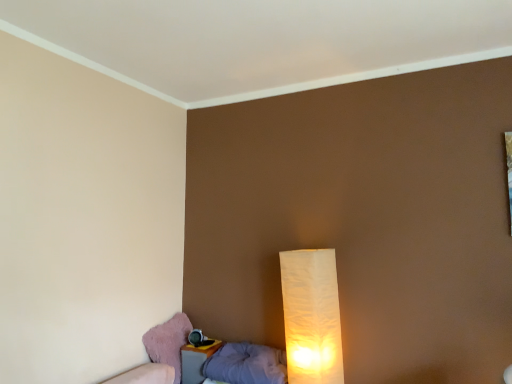
Question: Does gray fabric pillow at lower left appear on the right side of pink fabric swivel chair at lower left?

Choices:
 (A) yes
 (B) no

Answer: (A)

Question: Does gray fabric pillow at lower left lie in front of pink fabric swivel chair at lower left?

Choices:
 (A) yes
 (B) no

Answer: (A)

Question: Can you confirm if gray fabric pillow at lower left is wider than pink fabric swivel chair at lower left?

Choices:
 (A) yes
 (B) no

Answer: (A)

Question: Does gray fabric pillow at lower left have a larger size compared to pink fabric swivel chair at lower left?

Choices:
 (A) yes
 (B) no

Answer: (A)

Question: Does gray fabric pillow at lower left appear on the left side of pink fabric swivel chair at lower left?

Choices:
 (A) no
 (B) yes

Answer: (A)

Question: Does gray fabric pillow at lower left come behind pink fabric swivel chair at lower left?

Choices:
 (A) yes
 (B) no

Answer: (B)

Question: From a real-world perspective, is white paper lamp at lower right under gray fabric pillow at lower left?

Choices:
 (A) no
 (B) yes

Answer: (A)

Question: Is white paper lamp at lower right not within gray fabric pillow at lower left?

Choices:
 (A) yes
 (B) no

Answer: (A)

Question: Is white paper lamp at lower right facing away from gray fabric pillow at lower left?

Choices:
 (A) no
 (B) yes

Answer: (A)

Question: Can you confirm if white paper lamp at lower right is shorter than gray fabric pillow at lower left?

Choices:
 (A) no
 (B) yes

Answer: (A)

Question: Is white paper lamp at lower right beside gray fabric pillow at lower left?

Choices:
 (A) no
 (B) yes

Answer: (A)

Question: From the image's perspective, would you say white paper lamp at lower right is positioned over gray fabric pillow at lower left?

Choices:
 (A) no
 (B) yes

Answer: (B)

Question: From the image's perspective, is pink fabric swivel chair at lower left over white paper lamp at lower right?

Choices:
 (A) yes
 (B) no

Answer: (B)